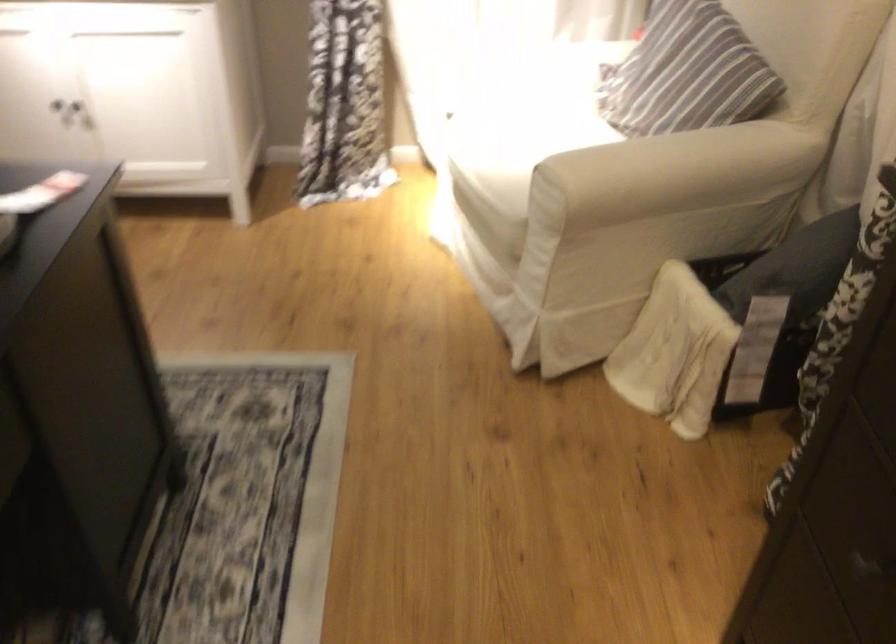
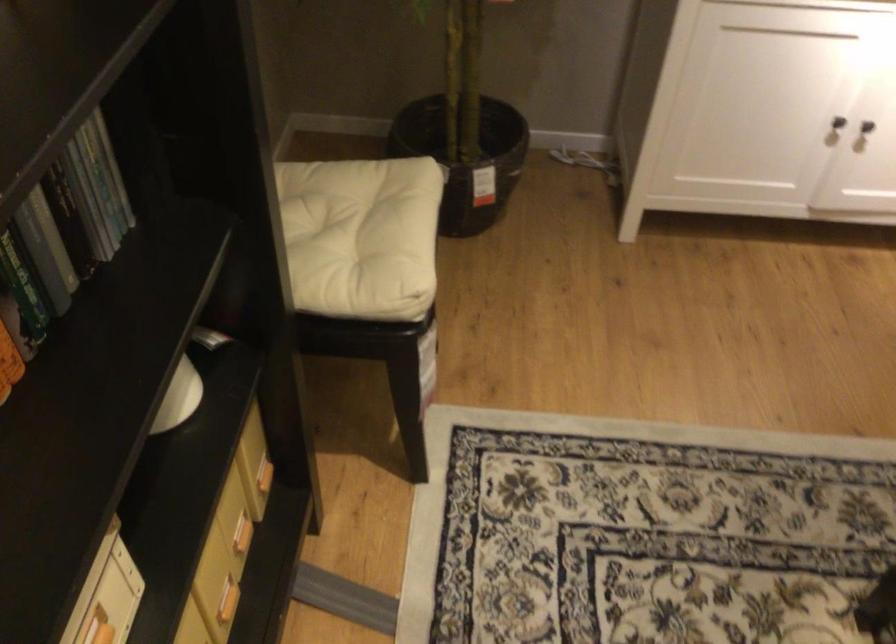
Question: Which direction would the cameraman need to move to produce the second image? Reply with the corresponding letter.

Choices:
 (A) Left
 (B) Right
 (C) Forward
 (D) Backward

Answer: (A)